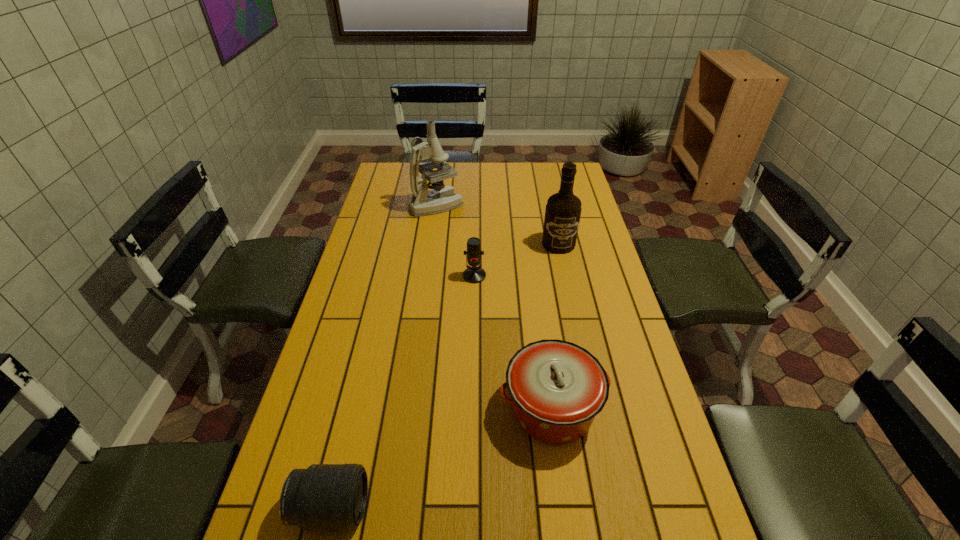
Locate an element on the screen. This screenshot has height=540, width=960. alcohol that is at the right edge is located at coordinates (563, 210).

Locate an element on the screen. casserole that is at the right edge is located at coordinates (557, 388).

Locate an element on the screen. This screenshot has width=960, height=540. vacant space at the far edge of the desktop is located at coordinates (520, 170).

Find the location of a particular element. vacant position at the left edge of the desktop is located at coordinates (362, 260).

The height and width of the screenshot is (540, 960). Identify the location of vacant space at the right edge of the desktop. (590, 348).

This screenshot has width=960, height=540. In the image, there is a desktop. Identify the location of free space at the far left corner. tap(393, 167).

Identify the location of free space at the far right corner. This screenshot has height=540, width=960. (580, 188).

Find the location of a particular element. The height and width of the screenshot is (540, 960). vacant region between the second nearest object and the fourth nearest object is located at coordinates (555, 326).

Where is `vacant space in between the third object from left to right and the casserole`? Image resolution: width=960 pixels, height=540 pixels. vacant space in between the third object from left to right and the casserole is located at coordinates (513, 341).

This screenshot has height=540, width=960. I want to click on free spot between the fourth farthest object and the second farthest object, so click(555, 326).